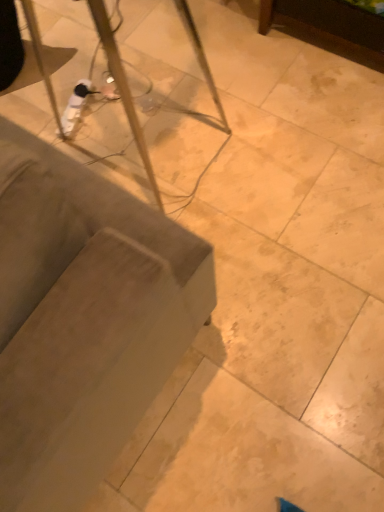
What is the approximate height of clear glass table at upper left?

3.32 centimeters.

This screenshot has width=384, height=512. What do you see at coordinates (83, 319) in the screenshot? I see `clear glass table at upper left` at bounding box center [83, 319].

At what (x,y) coordinates should I click in order to perform the action: click on clear glass table at upper left. Please return your answer as a coordinate pair (x, y). Looking at the image, I should click on (83, 319).

Where is `clear glass table at upper left`? clear glass table at upper left is located at coordinates (83, 319).